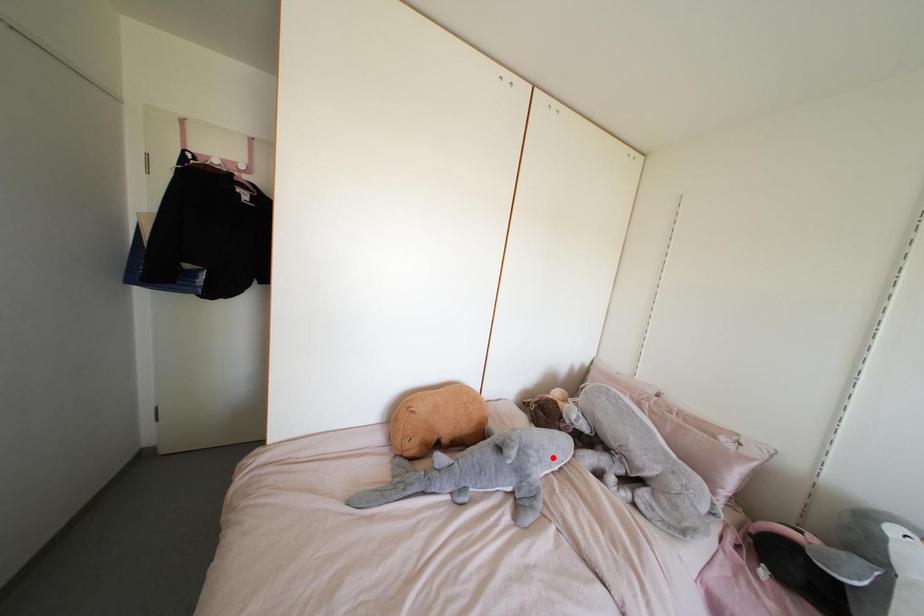
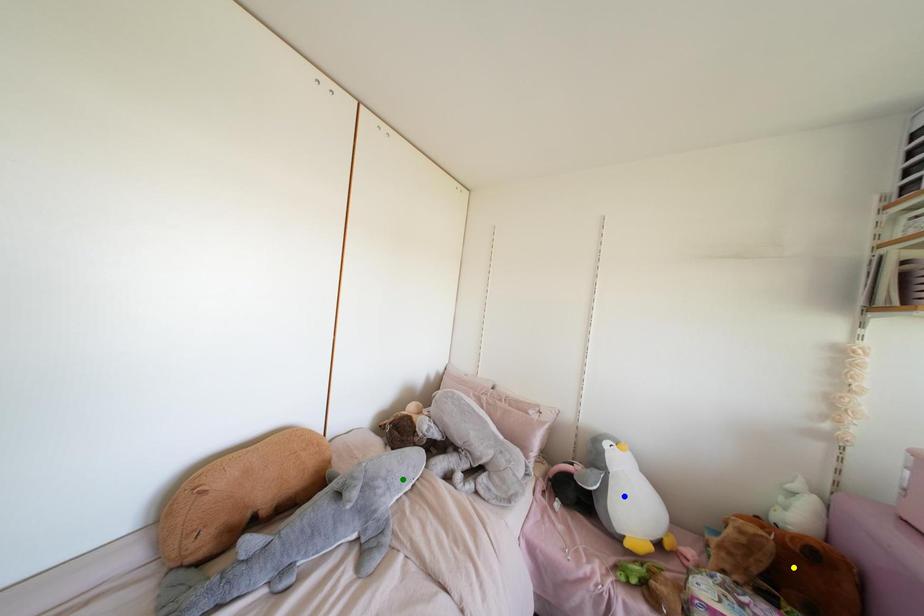
Question: I am providing you with two images of the same scene from different viewpoints. A red point is marked on the first image. You are given multiple points on the second image. Which point in image 2 represents the same 3d spot as the red point in image 1?

Choices:
 (A) blue point
 (B) yellow point
 (C) green point

Answer: (C)